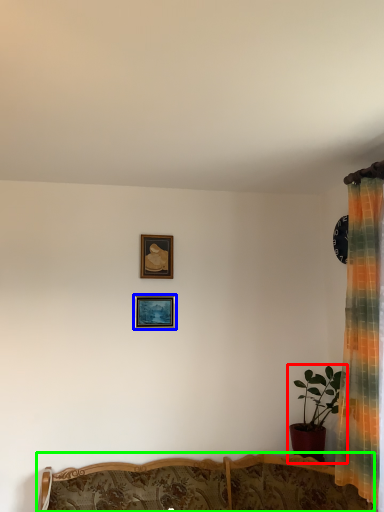
Question: Which is nearer to the houseplant (highlighted by a red box)? picture frame (highlighted by a blue box) or furniture (highlighted by a green box).

Choices:
 (A) picture frame
 (B) furniture

Answer: (B)